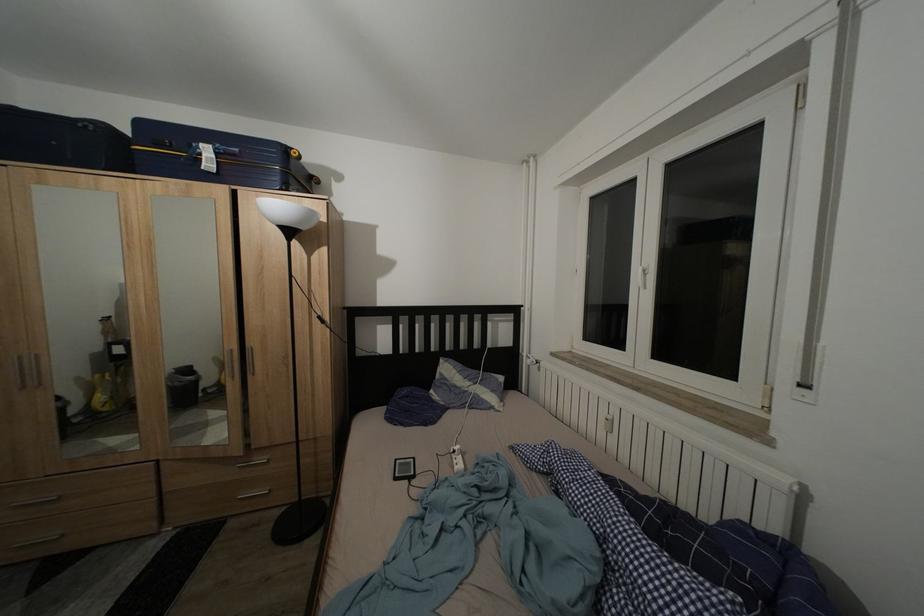
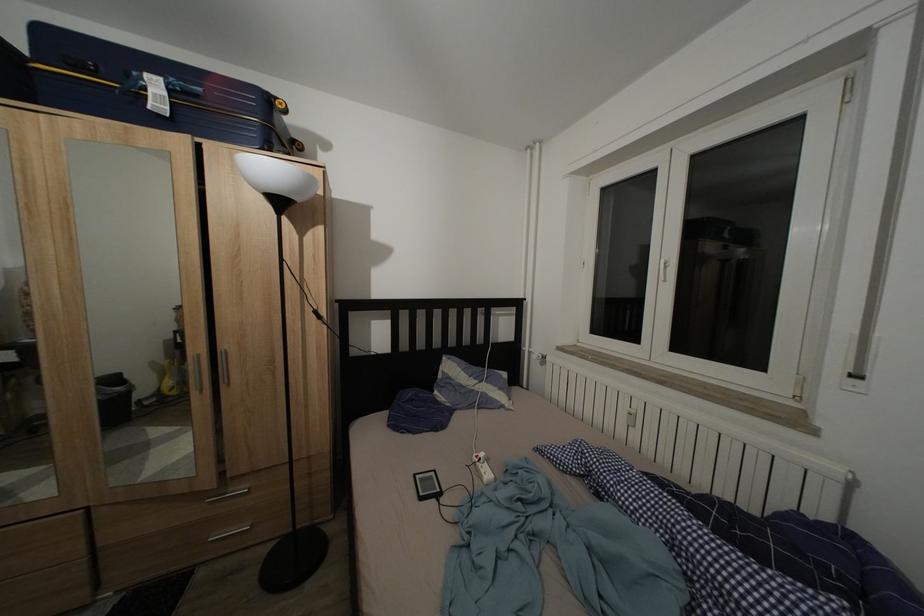
Question: The images are taken continuously from a first-person perspective. In which direction is your viewpoint rotating?

Choices:
 (A) Left
 (B) Right
 (C) Up
 (D) Down

Answer: (B)